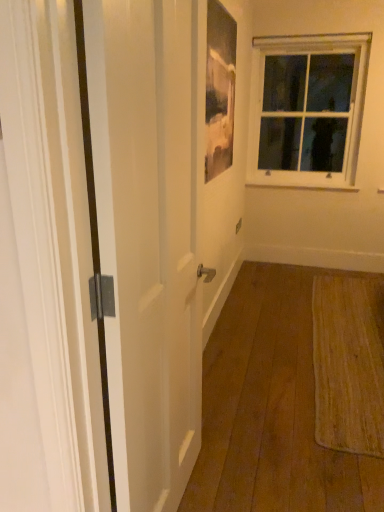
Question: From the image's perspective, is clear glass window at upper right on matte glass picture frame at upper center?

Choices:
 (A) no
 (B) yes

Answer: (B)

Question: Does clear glass window at upper right lie in front of matte glass picture frame at upper center?

Choices:
 (A) no
 (B) yes

Answer: (A)

Question: Is clear glass window at upper right smaller than matte glass picture frame at upper center?

Choices:
 (A) yes
 (B) no

Answer: (B)

Question: From a real-world perspective, is clear glass window at upper right on matte glass picture frame at upper center?

Choices:
 (A) no
 (B) yes

Answer: (A)

Question: Is clear glass window at upper right aimed at matte glass picture frame at upper center?

Choices:
 (A) yes
 (B) no

Answer: (A)

Question: Considering the positions of clear glass window at upper right and white painted wood at upper right in the image, is clear glass window at upper right bigger or smaller than white painted wood at upper right?

Choices:
 (A) small
 (B) big

Answer: (B)

Question: Is clear glass window at upper right situated inside white painted wood at upper right or outside?

Choices:
 (A) outside
 (B) inside

Answer: (A)

Question: In terms of width, does clear glass window at upper right look wider or thinner when compared to white painted wood at upper right?

Choices:
 (A) wide
 (B) thin

Answer: (A)

Question: From a real-world perspective, is clear glass window at upper right positioned above or below white painted wood at upper right?

Choices:
 (A) above
 (B) below

Answer: (A)

Question: Is clear glass window at upper right spatially inside matte glass picture frame at upper center, or outside of it?

Choices:
 (A) inside
 (B) outside

Answer: (B)

Question: From the image's perspective, is clear glass window at upper right positioned above or below matte glass picture frame at upper center?

Choices:
 (A) above
 (B) below

Answer: (A)

Question: Is clear glass window at upper right in front of or behind matte glass picture frame at upper center in the image?

Choices:
 (A) behind
 (B) front

Answer: (A)

Question: Looking at their shapes, would you say clear glass window at upper right is wider or thinner than matte glass picture frame at upper center?

Choices:
 (A) thin
 (B) wide

Answer: (B)

Question: Is white glossy door at left wider or thinner than clear glass window at upper right?

Choices:
 (A) wide
 (B) thin

Answer: (B)

Question: Would you say white glossy door at left is to the left or to the right of clear glass window at upper right in the picture?

Choices:
 (A) left
 (B) right

Answer: (A)